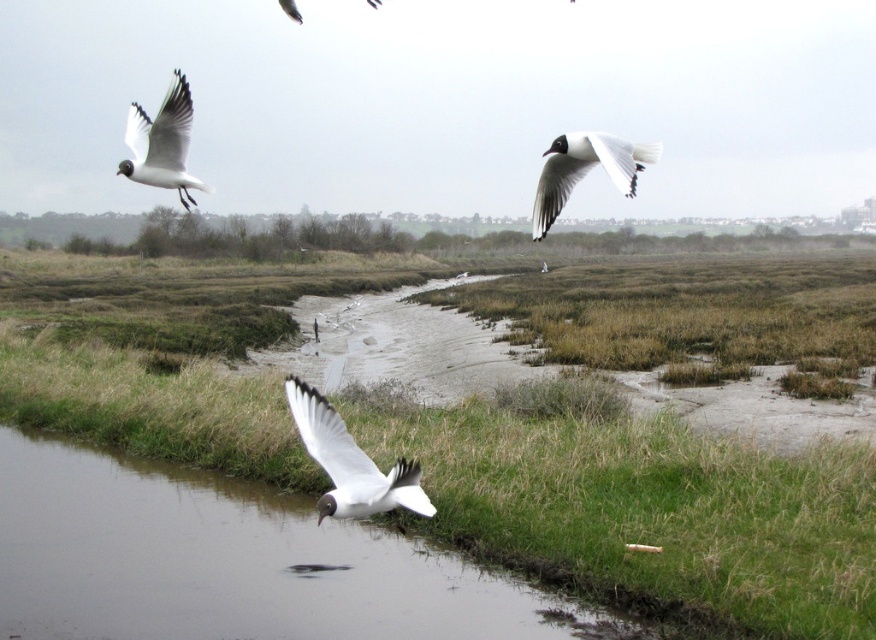
You are a photographer trying to capture the clear water at lower center and the white matte bird at upper right in the same frame. Based on their sizes in the image, which object appears smaller?

The clear water at lower center appears smaller because it has a lesser width compared to the white matte bird at upper right.

You are standing at the edge of the wetland and observe the green grass at lower center and the white matte bird at center. Which object is positioned higher in the scene?

The green grass at lower center is positioned above the white matte bird at center, so the grass is higher in the scene.